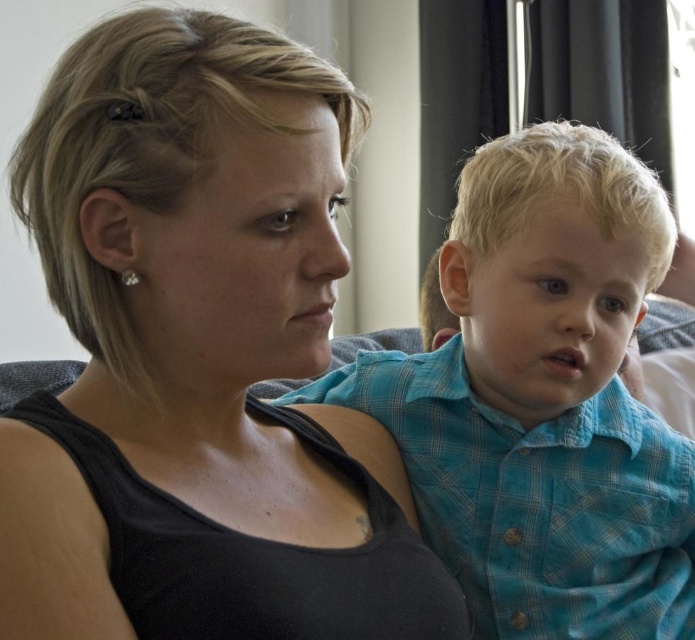
You are a photographer setting up for a portrait. You notice two subjects wearing the black matte tank top at center and the blue plaid shirt at center. Which clothing item is shorter in height?

The black matte tank top at center has a lesser height compared to the blue plaid shirt at center, so the black matte tank top at center is shorter in height.

You are standing in the room and want to reach the point marked at coordinates (188, 586). If you can stretch your arm 20 inches forward, will you be able to touch that point?

The distance of point (188, 586) from viewer is 21.71 inches, so stretching your arm 20 inches forward won not be enough to reach it.

You are a photographer setting up a shoot in this scene. You need to place a light source to the right of both the black matte tank top at center and the blue plaid shirt at center. Is this possible given their positions?

The black matte tank top at center is to the left of the blue plaid shirt at center, so placing a light source to the right of both would be possible as long as it is positioned to the right side of the blue plaid shirt at center.